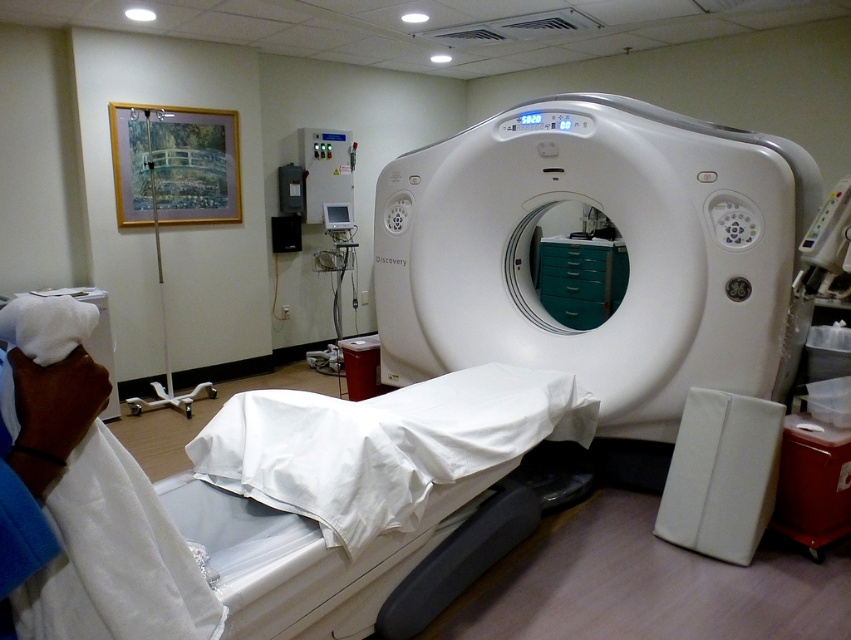
You are a technician in the medical imaging room. You need to move the white plastic pole at left to the storage area, which is behind the white glossy ct scanner at center. Can you move it directly behind the scanner without moving the scanner itself?

The white glossy ct scanner at center is in front of the white plastic pole at left, so moving the pole directly behind the scanner would require moving it to a position that is currently occupied by the scanner itself. Since the scanner cannot be moved, the pole cannot be placed directly behind it in that specific location.

You are a technician in the medical imaging room. You need to move the white plastic pole at left to the other side of the white glossy ct scanner at center. Will the pole fit next to the scanner if you place it there?

The white glossy ct scanner at center is wider than the white plastic pole at left, so the pole will fit next to the scanner when placed there.

You are a technician in the medical imaging room. You need to place a small sensor at the closest point to the camera between the two points labeled point [543,112] and point [164,342]. Which point should you choose?

You should choose point [543,112] because it is closer to the camera than point [164,342].